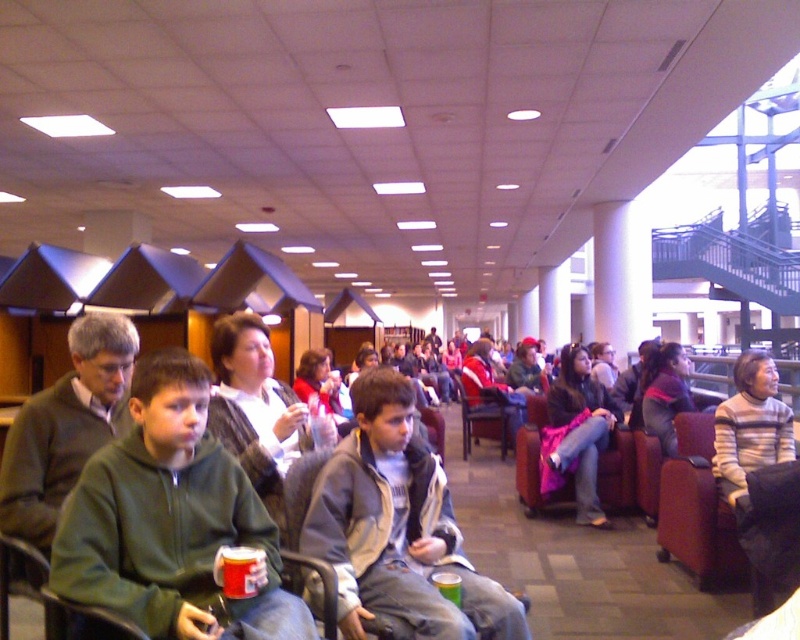
Which is below, green matte jacket at center or brown fabric chair at center?

Positioned lower is brown fabric chair at center.

Is green matte jacket at center above brown fabric chair at center?

Yes, green matte jacket at center is above brown fabric chair at center.

You are a GUI agent. You are given a task and a screenshot of the screen. Output one action in this format:
    pyautogui.click(x=<x>, y=<y>)
    Task: Click on the green matte jacket at center
    This screenshot has height=640, width=800.
    Given the screenshot: What is the action you would take?
    pyautogui.click(x=66, y=426)

Is gray fleece jacket at center above matte pink jacket at center?

Yes.

Between gray fleece jacket at center and matte pink jacket at center, which one appears on the left side from the viewer's perspective?

gray fleece jacket at center

Which is in front, point (326, 476) or point (592, 442)?

Positioned in front is point (326, 476).

I want to click on gray fleece jacket at center, so click(x=397, y=528).

Consider the image. Does green fleece jacket at center appear on the right side of striped sweater at right?

In fact, green fleece jacket at center is to the left of striped sweater at right.

Is green fleece jacket at center wider than striped sweater at right?

Indeed, green fleece jacket at center has a greater width compared to striped sweater at right.

Which is in front, point (64, 573) or point (772, 422)?

Point (64, 573) is more forward.

At what (x,y) coordinates should I click in order to perform the action: click on green fleece jacket at center. Please return your answer as a coordinate pair (x, y). This screenshot has height=640, width=800. Looking at the image, I should click on (172, 520).